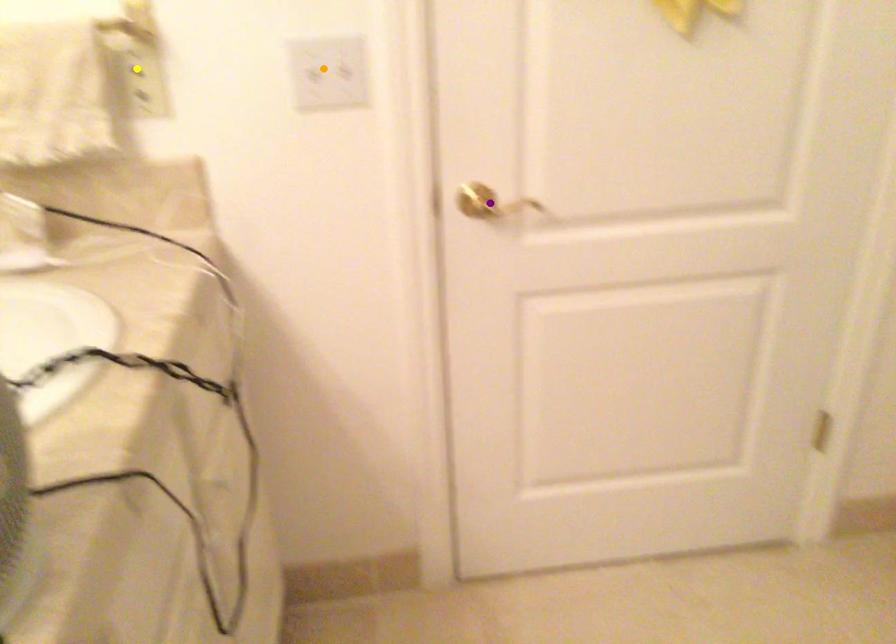
Order these from farthest to nearest:
orange point | yellow point | purple point

purple point → orange point → yellow point